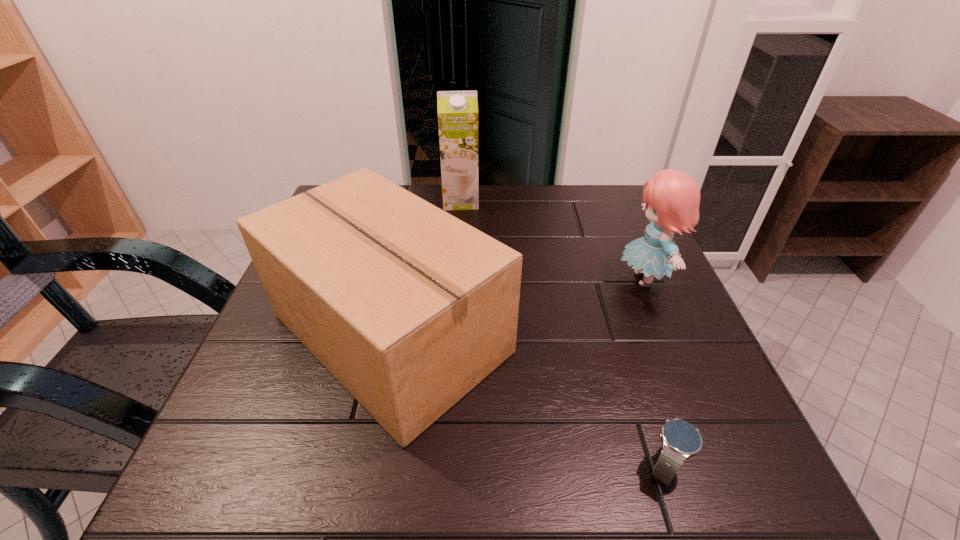
Find the location of a particular element. vacant space at the left edge of the desktop is located at coordinates 258,343.

Find the location of `vacant space at the right edge of the desktop`. vacant space at the right edge of the desktop is located at coordinates (663, 330).

Where is `free spot at the far right corner of the desktop`? This screenshot has width=960, height=540. free spot at the far right corner of the desktop is located at coordinates click(x=641, y=225).

What are the coordinates of `free point between the box and the shortest object` in the screenshot? It's located at (528, 400).

In order to click on unoccupied area between the shortest object and the soya milk in this screenshot , I will do coord(564,333).

Where is `blank region between the farthest object and the shortest object`? The width and height of the screenshot is (960, 540). blank region between the farthest object and the shortest object is located at coordinates (564, 333).

Image resolution: width=960 pixels, height=540 pixels. Identify the location of unoccupied area between the soya milk and the doll. (553, 240).

Where is `empty location between the watch and the box`? The height and width of the screenshot is (540, 960). empty location between the watch and the box is located at coordinates (528, 400).

You are a GUI agent. You are given a task and a screenshot of the screen. Output one action in this format:
    pyautogui.click(x=<x>, y=<y>)
    Task: Click on the free space between the doll and the farthest object
    The height and width of the screenshot is (540, 960).
    Given the screenshot: What is the action you would take?
    pyautogui.click(x=553, y=240)

You are a GUI agent. You are given a task and a screenshot of the screen. Output one action in this format:
    pyautogui.click(x=<x>, y=<y>)
    Task: Click on the free spot between the shortest object and the box
    
    Given the screenshot: What is the action you would take?
    pyautogui.click(x=528, y=400)